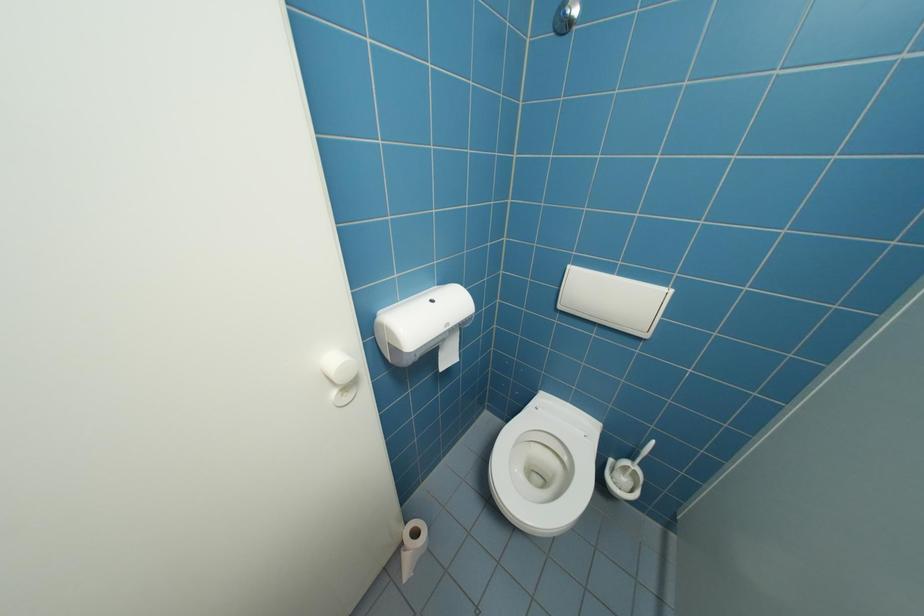
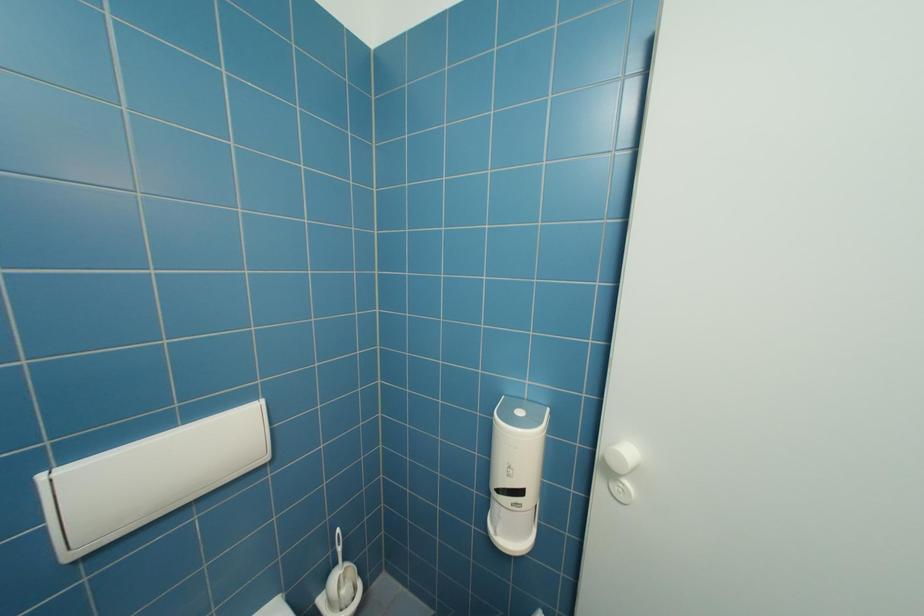
Question: The camera is either moving clockwise (left) or counter-clockwise (right) around the object. The first image is from the beginning of the video and the second image is from the end. Is the camera moving left or right when shooting the video?

Choices:
 (A) Left
 (B) Right

Answer: (A)